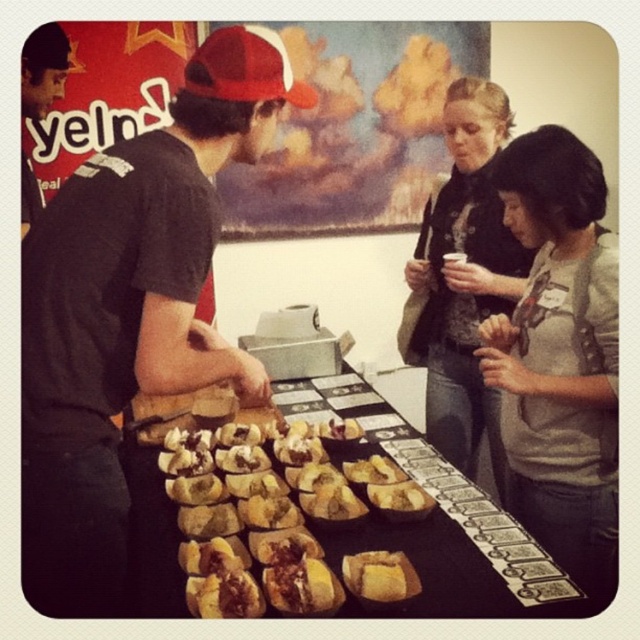
You are standing in front of the table with baked goods. You want to pick up an item located at point [44,108] and another at point [317,596]. Which item will you reach first?

The item at point [44,108] will be reached first because it is closer to you than the item at point [317,596].